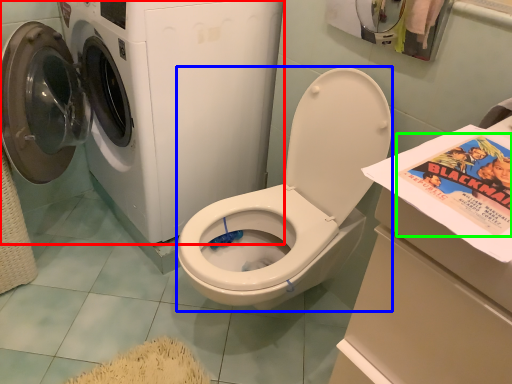
Question: Estimate the real-world distances between objects in this image. Which object is closer to washing machine (highlighted by a red box), washer (highlighted by a blue box) or comic book (highlighted by a green box)?

Choices:
 (A) washer
 (B) comic book

Answer: (A)